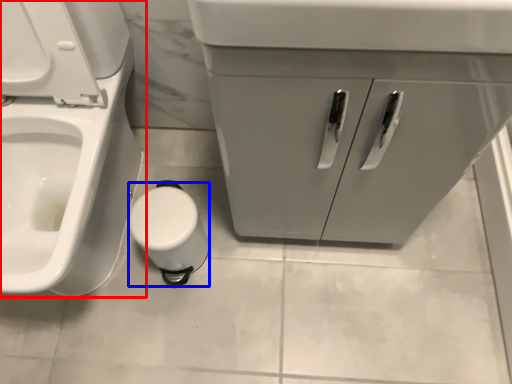
Question: Which object appears farthest to the camera in this image, toilet (highlighted by a red box) or toilet paper (highlighted by a blue box)?

Choices:
 (A) toilet
 (B) toilet paper

Answer: (B)